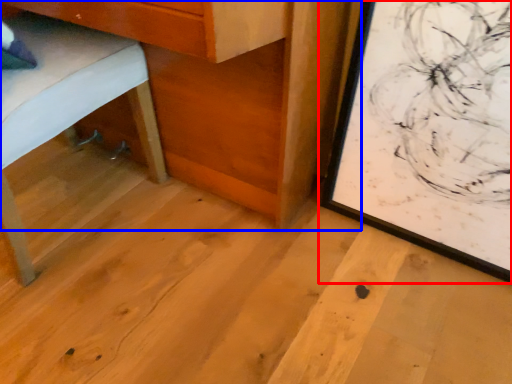
Question: Which of the following is the closest to the observer, picture frame (highlighted by a red box) or table (highlighted by a blue box)?

Choices:
 (A) picture frame
 (B) table

Answer: (B)